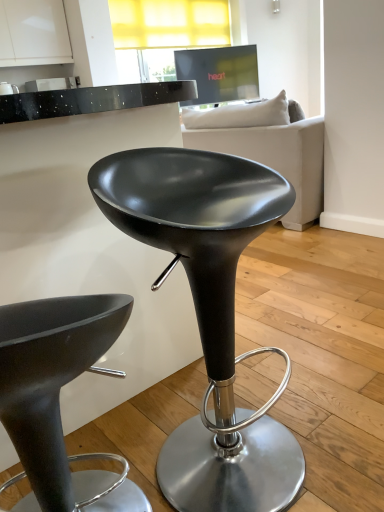
Question: Are matte black stool at center, which appears as the 2th stool when viewed from the right, and white fabric couch at upper center making contact?

Choices:
 (A) yes
 (B) no

Answer: (B)

Question: Is matte black stool at center, the 1th stool positioned from the left, facing towards white fabric couch at upper center?

Choices:
 (A) yes
 (B) no

Answer: (A)

Question: Is matte black stool at center, which appears as the 2th stool when viewed from the right, at the left side of white fabric couch at upper center?

Choices:
 (A) no
 (B) yes

Answer: (B)

Question: From the image's perspective, is matte black stool at center, the 1th stool positioned from the left, on top of white fabric couch at upper center?

Choices:
 (A) no
 (B) yes

Answer: (A)

Question: From a real-world perspective, is matte black stool at center, the 1th stool positioned from the left, located higher than white fabric couch at upper center?

Choices:
 (A) no
 (B) yes

Answer: (A)

Question: Considering their positions, is matte black stool at center, the 1th stool positioned from the right, located in front of or behind matte black stool at center, the 1th stool positioned from the left?

Choices:
 (A) behind
 (B) front

Answer: (A)

Question: From the image's perspective, relative to matte black stool at center, the 1th stool positioned from the left, is matte black stool at center, the 1th stool positioned from the right, above or below?

Choices:
 (A) above
 (B) below

Answer: (A)

Question: Is matte black stool at center, the 1th stool positioned from the right, wider or thinner than matte black stool at center, the 1th stool positioned from the left?

Choices:
 (A) thin
 (B) wide

Answer: (B)

Question: Does point (140, 220) appear closer or farther from the camera than point (34, 479)?

Choices:
 (A) closer
 (B) farther

Answer: (A)

Question: From the image's perspective, is matte black stool at center, acting as the 2th stool starting from the left, located above or below white fabric couch at upper center?

Choices:
 (A) below
 (B) above

Answer: (A)

Question: Considering the relative positions of matte black stool at center, the 1th stool positioned from the right, and white fabric couch at upper center in the image provided, is matte black stool at center, the 1th stool positioned from the right, to the left or to the right of white fabric couch at upper center?

Choices:
 (A) right
 (B) left

Answer: (B)

Question: Relative to white fabric couch at upper center, is matte black stool at center, acting as the 2th stool starting from the left, in front or behind?

Choices:
 (A) behind
 (B) front

Answer: (B)

Question: Is point (284, 206) positioned closer to the camera than point (251, 143)?

Choices:
 (A) closer
 (B) farther

Answer: (A)

Question: Would you say matte black stool at center, the 1th stool positioned from the left, is inside or outside white fabric couch at upper center?

Choices:
 (A) inside
 (B) outside

Answer: (B)

Question: From a real-world perspective, is matte black stool at center, which appears as the 2th stool when viewed from the right, positioned above or below white fabric couch at upper center?

Choices:
 (A) below
 (B) above

Answer: (A)